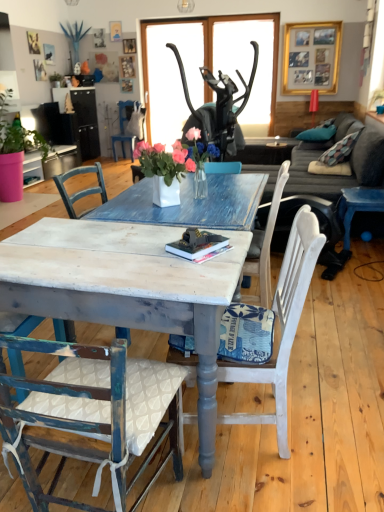
This screenshot has width=384, height=512. I want to click on gold metallic picture frame at upper center, so click(x=311, y=57).

What is the approximate width of pink matte pot at left?

pink matte pot at left is 97.53 centimeters wide.

What do you see at coordinates (15, 151) in the screenshot? This screenshot has width=384, height=512. I see `pink matte pot at left` at bounding box center [15, 151].

This screenshot has width=384, height=512. I want to click on white fabric chair at center, acting as the third chair starting from the left, so click(x=281, y=326).

Describe the element at coordinates (126, 288) in the screenshot. I see `distressed wood table at center` at that location.

Identify the location of distressed wood table at center. (126, 288).

Where is `distressed white chair at lower left, which is counted as the fourth chair, starting from the back`? The height and width of the screenshot is (512, 384). distressed white chair at lower left, which is counted as the fourth chair, starting from the back is located at coordinates (93, 412).

Is gray fabric couch at center positioned beyond the bounds of pink matte pot at left?

Yes.

Does point (248, 165) come behind point (15, 181)?

No, (248, 165) is closer to viewer.

Can you tell me how much gray fabric couch at center and pink matte pot at left differ in facing direction?

The angle between the facing direction of gray fabric couch at center and the facing direction of pink matte pot at left is 179 degrees.

At what (x,y) coordinates should I click in order to perform the action: click on houseplant that is above the gray fabric couch at center (from a real-world perspective). Please return your answer as a coordinate pair (x, y). This screenshot has height=512, width=384. Looking at the image, I should click on (15, 151).

From a real-world perspective, which is physically above, pink matte pot at left or white fabric chair at center, the second chair when ordered from back to front?

From a 3D spatial view, pink matte pot at left is above.

From the image's perspective, does pink matte pot at left appear lower than white fabric chair at center, marked as the 2th chair in a top-to-bottom arrangement?

Incorrect, from the image's perspective, pink matte pot at left is higher than white fabric chair at center, marked as the 2th chair in a top-to-bottom arrangement.

Which of these two, pink matte pot at left or white fabric chair at center, the second chair when ordered from back to front, is smaller?

With smaller size is white fabric chair at center, the second chair when ordered from back to front.

Considering the relative sizes of distressed wood table at center and distressed white chair at lower left, which is counted as the 4th chair, starting from the top, in the image provided, is distressed wood table at center shorter than distressed white chair at lower left, which is counted as the 4th chair, starting from the top,?

Yes.

Would you say distressed wood table at center is inside or outside distressed white chair at lower left, which is counted as the fourth chair, starting from the back?

distressed wood table at center is spatially situated outside distressed white chair at lower left, which is counted as the fourth chair, starting from the back.

Is distressed wood table at center looking in the opposite direction of distressed white chair at lower left, the first chair from the front?

No, distressed wood table at center's orientation is not away from distressed white chair at lower left, the first chair from the front.

Consider the image. From a real-world perspective, is distressed wood table at center on distressed white chair at lower left, which is counted as the 4th chair, starting from the top?

No, from a real-world perspective, distressed wood table at center is not on top of distressed white chair at lower left, which is counted as the 4th chair, starting from the top.

Does white fabric chair at center, the second chair when ordered from back to front, turn towards distressed wood table at center?

No.

In the image, is white fabric chair at center, the third chair when ordered from bottom to top, positioned in front of or behind distressed wood table at center?

Clearly, white fabric chair at center, the third chair when ordered from bottom to top, is behind distressed wood table at center.

Can you confirm if white fabric chair at center, the first chair when ordered from right to left, is thinner than distressed wood table at center?

Yes.

Locate an element on the screen. This screenshot has width=384, height=512. coffee table below the teal fabric pillow at upper right (from a real-world perspective) is located at coordinates (126, 288).

Is distressed wood table at center at the left side of teal fabric pillow at upper right?

Yes, distressed wood table at center is to the left of teal fabric pillow at upper right.

Which is behind, distressed wood table at center or teal fabric pillow at upper right?

teal fabric pillow at upper right is more distant.

Is distressed wood table at center aimed at teal fabric pillow at upper right?

No, distressed wood table at center is not aimed at teal fabric pillow at upper right.

Considering the sizes of objects pink matte pot at left and white fabric chair at center, acting as the third chair starting from the left, in the image provided, who is smaller, pink matte pot at left or white fabric chair at center, acting as the third chair starting from the left,?

With smaller size is white fabric chair at center, acting as the third chair starting from the left.

Based on the photo, from a real-world perspective, is pink matte pot at left physically located above or below white fabric chair at center, the third chair viewed from the top?

In terms of real-world spatial position, pink matte pot at left is above white fabric chair at center, the third chair viewed from the top.

Is pink matte pot at left outside of white fabric chair at center, which ranks as the second chair in right-to-left order?

Absolutely, pink matte pot at left is external to white fabric chair at center, which ranks as the second chair in right-to-left order.

Considering the points (47, 156) and (231, 381), which point is behind, point (47, 156) or point (231, 381)?

The point (47, 156) is behind.

From a real-world perspective, is distressed wood table at center positioned above or below gold metallic picture frame at upper center?

distressed wood table at center is situated lower than gold metallic picture frame at upper center in the real world.

Would you say gold metallic picture frame at upper center is part of distressed wood table at center's contents?

Definitely not — gold metallic picture frame at upper center is not inside distressed wood table at center.

Is distressed wood table at center to the left or to the right of gold metallic picture frame at upper center in the image?

Clearly, distressed wood table at center is on the left of gold metallic picture frame at upper center in the image.

Is distressed wood table at center positioned before gold metallic picture frame at upper center?

Yes, it is in front of gold metallic picture frame at upper center.

Identify the location of couch in front of the pink matte pot at left. The width and height of the screenshot is (384, 512). (318, 175).

Find the location of `chair that is the 4th one when counting rightward from the pink matte pot at left`. chair that is the 4th one when counting rightward from the pink matte pot at left is located at coordinates (265, 245).

Considering their positions, is distressed wood table at center positioned further to white fabric chair at upper center, which ranks as the 4th chair in front-to-back order, than pink matte pot at left?

Among the two, distressed wood table at center is located further to white fabric chair at upper center, which ranks as the 4th chair in front-to-back order.

Looking at this image, looking at the image, which one is located further to distressed white chair at lower left, which is counted as the fourth chair, starting from the back, white fabric chair at center, which appears as the third chair when viewed from the front, or white ceramic vase at center?

Among the two, white ceramic vase at center is located further to distressed white chair at lower left, which is counted as the fourth chair, starting from the back.

Estimate the real-world distances between objects in this image. Which object is closer to distressed white chair at lower left, which is the 3th chair from right to left, gold metallic picture frame at upper center or white ceramic vase at center?

white ceramic vase at center lies closer to distressed white chair at lower left, which is the 3th chair from right to left, than the other object.

When comparing their distances from distressed white chair at lower left, which is the first chair in bottom-to-top order, does white fabric chair at center, acting as the third chair starting from the left, or white fabric chair at upper center, the 1th chair positioned from the back, seem further?

white fabric chair at upper center, the 1th chair positioned from the back, is positioned further to the anchor distressed white chair at lower left, which is the first chair in bottom-to-top order.

From the image, which object appears to be nearer to white fabric chair at center, the 4th chair in the left-to-right sequence, distressed white chair at lower left, which is the first chair in bottom-to-top order, or pink matte pot at left?

distressed white chair at lower left, which is the first chair in bottom-to-top order, lies closer to white fabric chair at center, the 4th chair in the left-to-right sequence, than the other object.

Which object lies further to the anchor point white fabric chair at upper center, which ranks as the 4th chair in front-to-back order, gold metallic picture frame at upper center or white ceramic vase at center?

white ceramic vase at center is positioned further to the anchor white fabric chair at upper center, which ranks as the 4th chair in front-to-back order.

Estimate the real-world distances between objects in this image. Which object is closer to pink matte pot at left, gray fabric couch at center or white fabric chair at center, the 4th chair in the left-to-right sequence?

gray fabric couch at center is closer to pink matte pot at left.

Considering their positions, is distressed wood table at center positioned further to teal fabric pillow at upper right than pink matte pot at left?

Based on the image, distressed wood table at center appears to be further to teal fabric pillow at upper right.

Find the location of `pillow between distressed wood table at center and white fabric chair at upper center, placed as the 1th chair when sorted from left to right, in the front-back direction`. pillow between distressed wood table at center and white fabric chair at upper center, placed as the 1th chair when sorted from left to right, in the front-back direction is located at coordinates (318, 133).

Find the location of a particular element. The height and width of the screenshot is (512, 384). houseplant between distressed white chair at lower left, which is counted as the fourth chair, starting from the back, and gold metallic picture frame at upper center, along the z-axis is located at coordinates (15, 151).

The image size is (384, 512). I want to click on coffee table between white fabric chair at center, acting as the third chair starting from the left, and white fabric chair at center, the 4th chair in the left-to-right sequence, in the front-back direction, so click(126, 288).

Image resolution: width=384 pixels, height=512 pixels. Identify the location of floral arrangement between pink matte pot at left and teal fabric pillow at upper right from left to right. (175, 167).